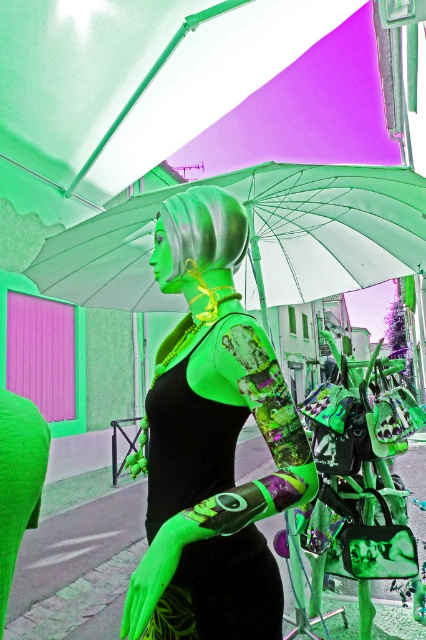
Can you confirm if green fabric canopy at upper center is positioned below green matte sculpture at lower left?

Incorrect, green fabric canopy at upper center is not positioned below green matte sculpture at lower left.

Which is in front, point (201, 170) or point (43, 420)?

Point (43, 420) is in front.

Is point (135, 72) positioned after point (25, 435)?

Yes, point (135, 72) is farther from viewer.

Locate an element on the screen. This screenshot has height=640, width=426. green fabric canopy at upper center is located at coordinates [187, 93].

Is the position of black matte dress at center more distant than that of green matte sculpture at lower left?

That is True.

Who is lower down, black matte dress at center or green matte sculpture at lower left?

black matte dress at center is lower down.

Find the location of a particular element. black matte dress at center is located at coordinates (221, 592).

Can you confirm if transparent plastic umbrella at center is positioned to the left of green matte sculpture at lower left?

Incorrect, transparent plastic umbrella at center is not on the left side of green matte sculpture at lower left.

Is point (147, 307) positioned before point (0, 413)?

That is False.

Does point (342, 179) come in front of point (45, 474)?

That is False.

At what (x,y) coordinates should I click in order to perform the action: click on transparent plastic umbrella at center. Please return your answer as a coordinate pair (x, y). Looking at the image, I should click on (255, 237).